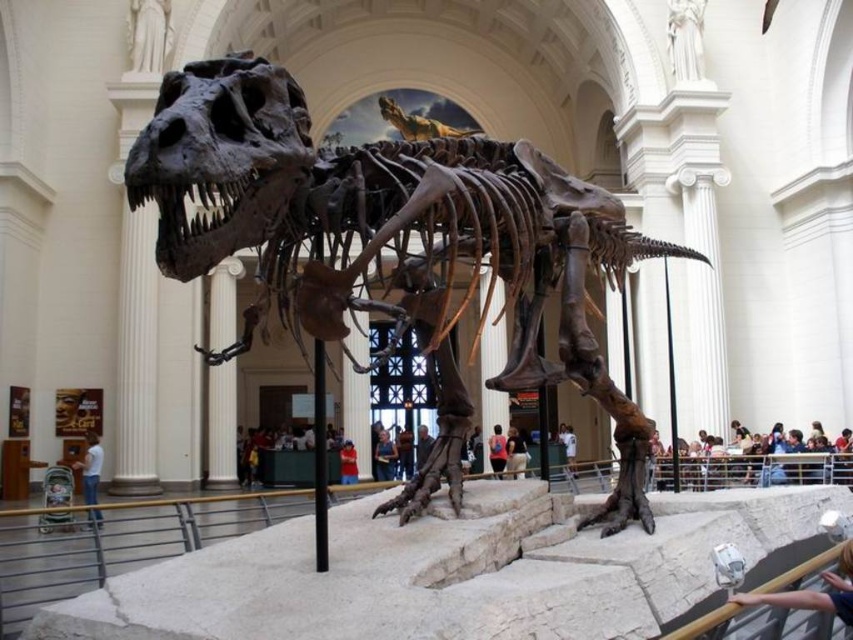
Question: Which of the following is the closest to the observer?

Choices:
 (A) (300, 202)
 (B) (838, 563)
 (C) (351, 472)

Answer: (A)

Question: Does light brown wooden bench at lower right lie in front of white cotton shirt at lower left?

Choices:
 (A) no
 (B) yes

Answer: (A)

Question: Is white cotton shirt at lower left positioned behind light brown leather jacket at center?

Choices:
 (A) no
 (B) yes

Answer: (A)

Question: Which object is closer to the camera taking this photo?

Choices:
 (A) blue denim jeans at lower right
 (B) rusty metallic skeleton at center
 (C) white cotton shirt at lower left

Answer: (B)

Question: Does pink fabric shirt at center have a greater width compared to white cotton shirt at center?

Choices:
 (A) no
 (B) yes

Answer: (A)

Question: Among these points, which one is nearest to the camera?

Choices:
 (A) (799, 593)
 (B) (160, 164)

Answer: (B)